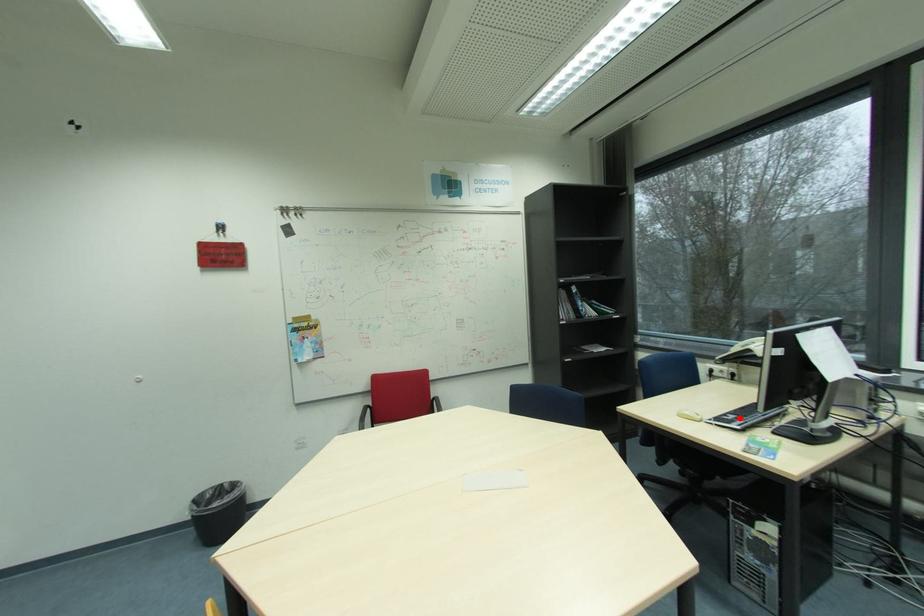
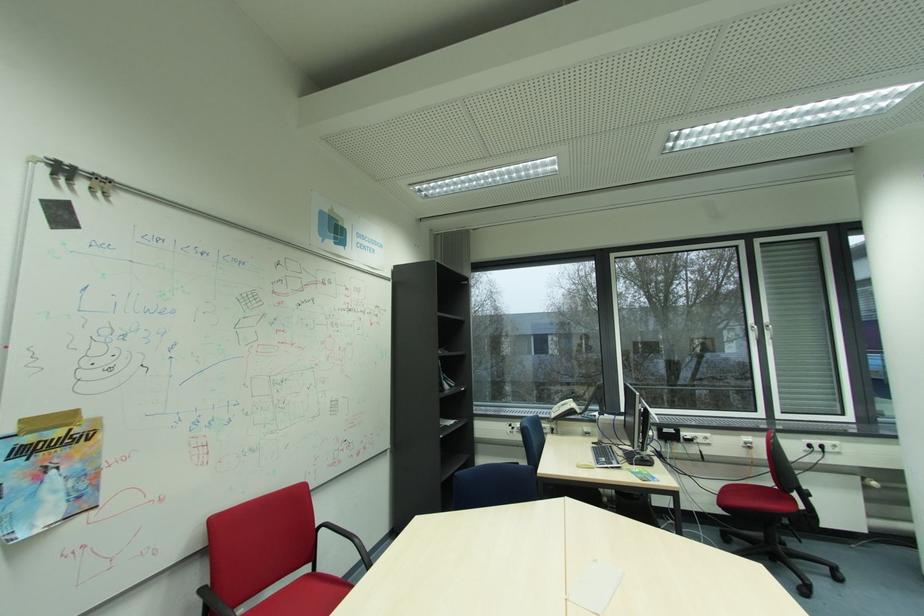
Find the pixel in the second image that matches the highlighted location in the first image.

(611, 460)